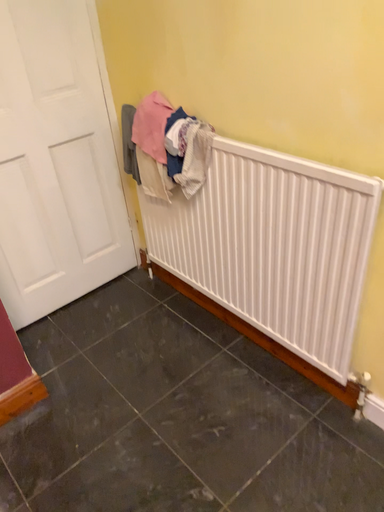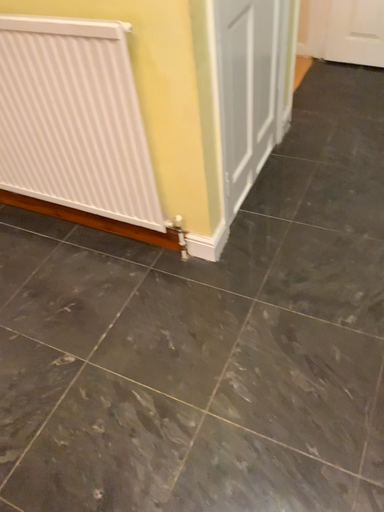
Question: How did the camera likely rotate when shooting the video?

Choices:
 (A) rotated left
 (B) rotated right

Answer: (B)